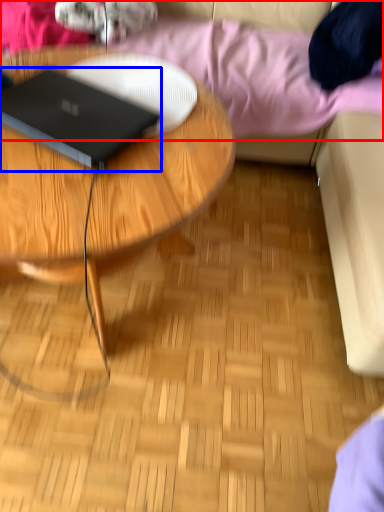
Question: Which of the following is the farthest to the observer, bedding (highlighted by a red box) or laptop (highlighted by a blue box)?

Choices:
 (A) bedding
 (B) laptop

Answer: (A)